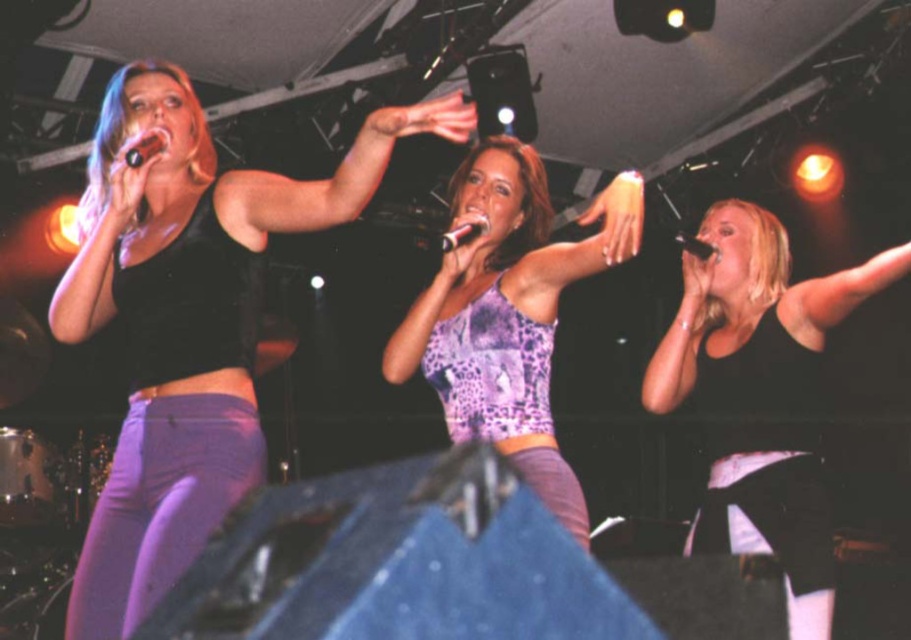
Does point (443, 252) come closer to viewer compared to point (708, 243)?

Yes, point (443, 252) is closer to viewer.

Does black plastic microphone at center have a lesser width compared to black matte microphone at upper center?

Indeed, black plastic microphone at center has a lesser width compared to black matte microphone at upper center.

Which is in front, point (474, 220) or point (715, 253)?

Point (474, 220) is more forward.

This screenshot has width=911, height=640. I want to click on black plastic microphone at center, so click(462, 234).

Who is higher up, black matte tank top at left or black matte microphone at upper center?

black matte microphone at upper center is above.

Consider the image. Between black matte tank top at left and black matte microphone at upper center, which one appears on the right side from the viewer's perspective?

Positioned to the right is black matte microphone at upper center.

The height and width of the screenshot is (640, 911). I want to click on black matte tank top at left, so click(188, 321).

I want to click on black matte tank top at left, so click(x=188, y=321).

Is black matte tank top at left bigger than purple leopard print tank top at center?

Yes, black matte tank top at left is bigger than purple leopard print tank top at center.

Is black matte tank top at left wider than purple leopard print tank top at center?

Indeed, black matte tank top at left has a greater width compared to purple leopard print tank top at center.

At what (x,y) coordinates should I click in order to perform the action: click on black matte tank top at left. Please return your answer as a coordinate pair (x, y). Looking at the image, I should click on (188, 321).